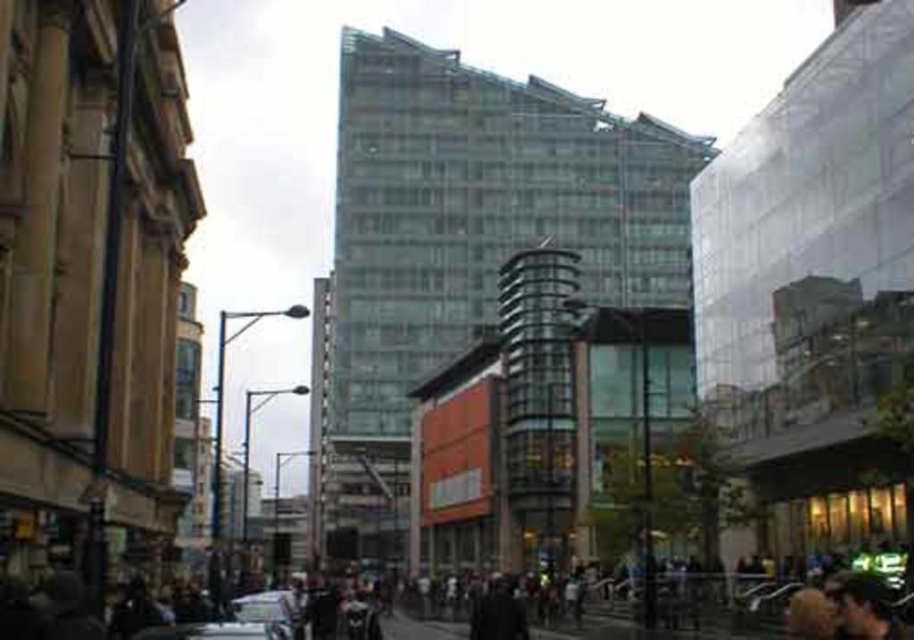
Question: Where is metallic silver car at lower center located in relation to silver metallic car at lower center in the image?

Choices:
 (A) below
 (B) above

Answer: (B)

Question: Is metallic silver car at lower center thinner than silver metallic car at lower center?

Choices:
 (A) yes
 (B) no

Answer: (A)

Question: Which point is farther from the camera taking this photo?

Choices:
 (A) (154, 627)
 (B) (287, 589)

Answer: (B)

Question: In this image, where is metallic silver car at lower center located relative to silver metallic car at lower center?

Choices:
 (A) left
 (B) right

Answer: (B)